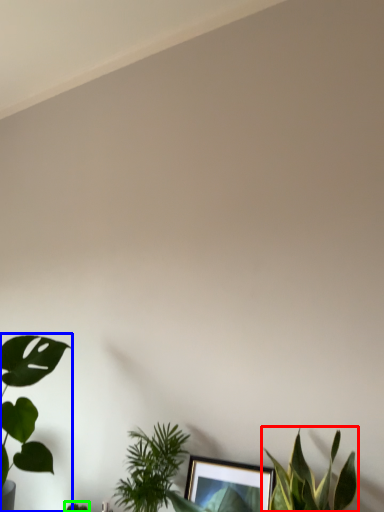
Question: Which object is positioned farthest from houseplant (highlighted by a red box)? Select from houseplant (highlighted by a blue box) and plant (highlighted by a green box).

Choices:
 (A) houseplant
 (B) plant

Answer: (B)